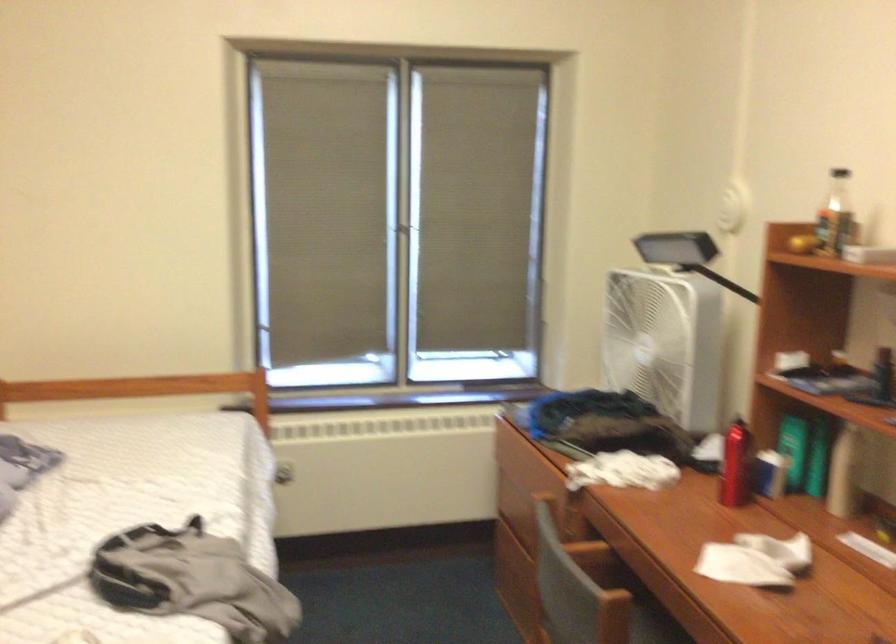
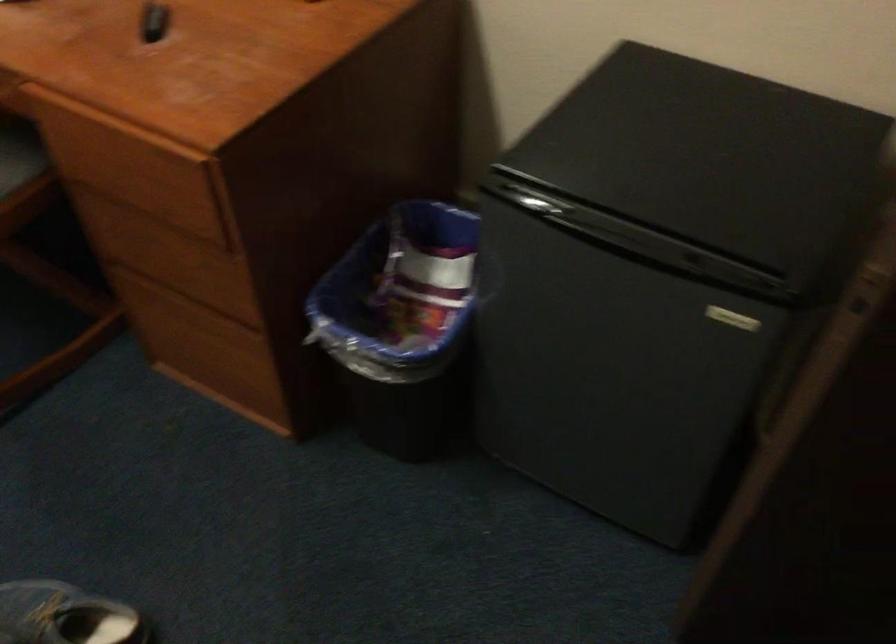
Consider the image. First-person continuous shooting, in which direction is the camera rotating?

The camera rotated toward right-down.